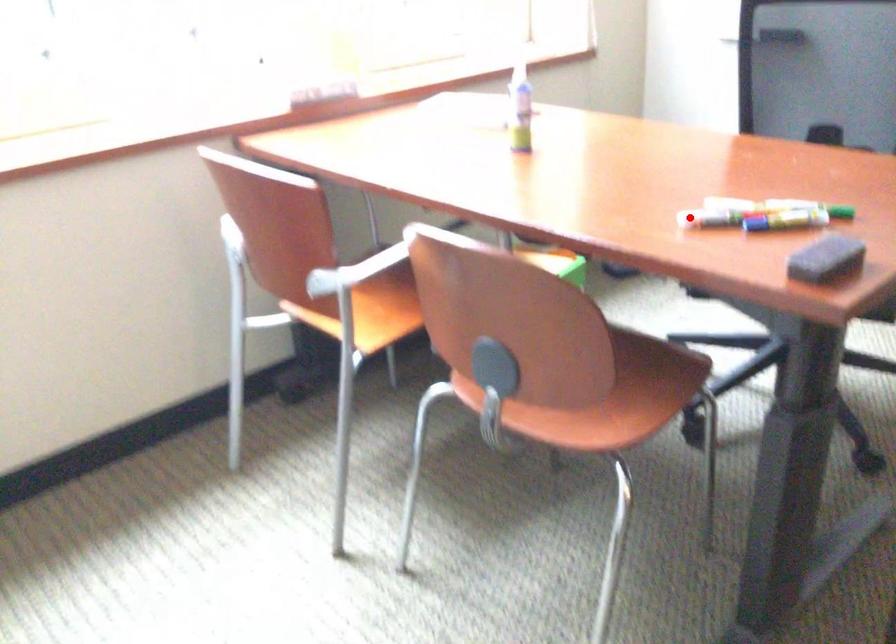
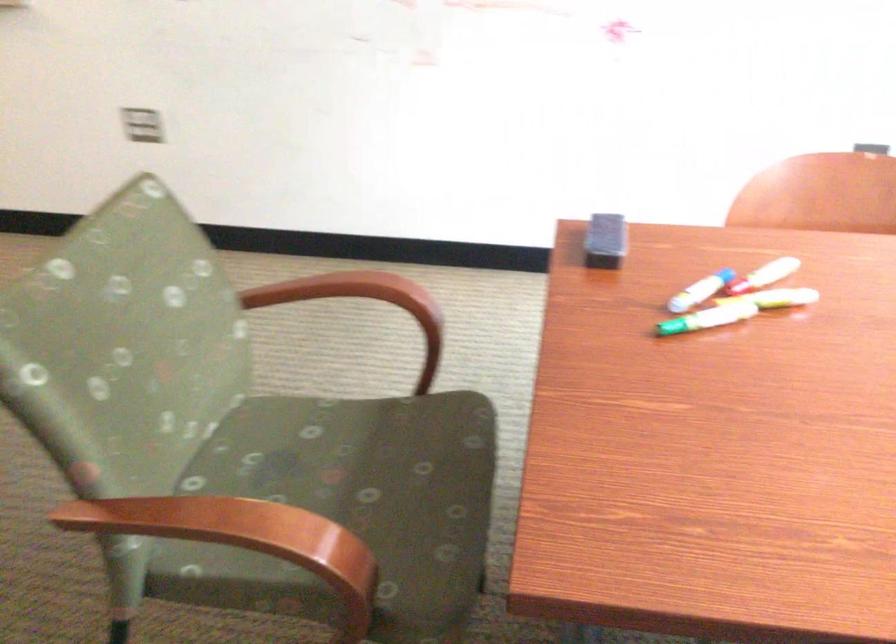
Question: I am providing you with two images of the same scene from different viewpoints. A red point is shown in image1. For the corresponding object point in image2, is it positioned nearer or farther from the camera?

Choices:
 (A) Nearer
 (B) Farther

Answer: (A)